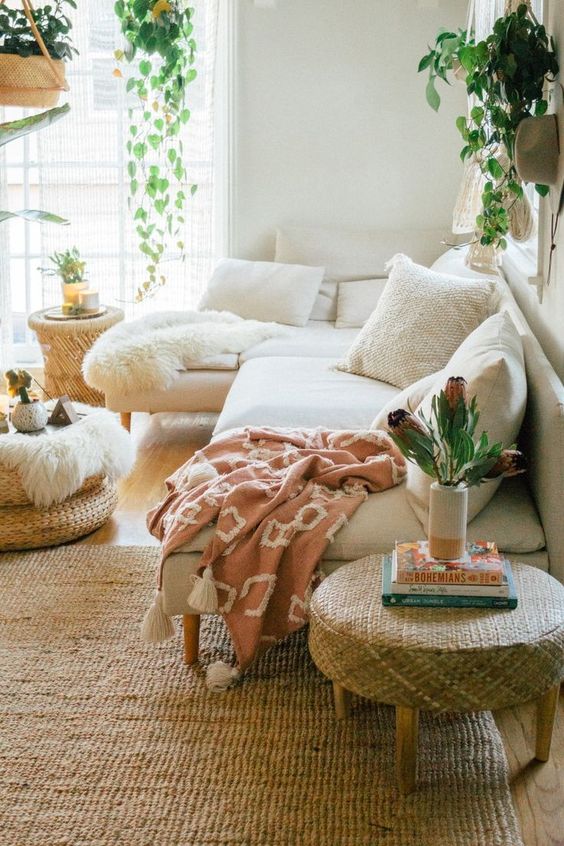
You are a GUI agent. You are given a task and a screenshot of the screen. Output one action in this format:
    pyautogui.click(x=<x>, y=<y>)
    Task: Click on the hard wood floor
    
    Given the screenshot: What is the action you would take?
    pyautogui.click(x=162, y=449), pyautogui.click(x=138, y=490), pyautogui.click(x=536, y=800)